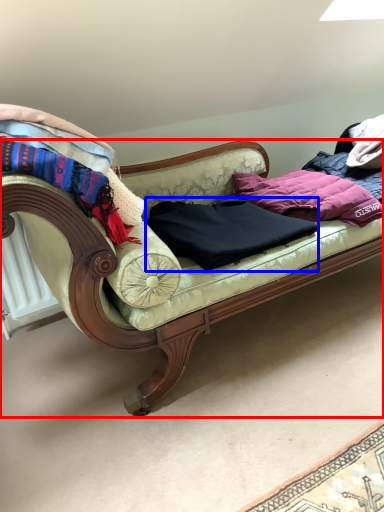
Question: Which of the following is the farthest to the observer, studio couch (highlighted by a red box) or clothing (highlighted by a blue box)?

Choices:
 (A) studio couch
 (B) clothing

Answer: (B)